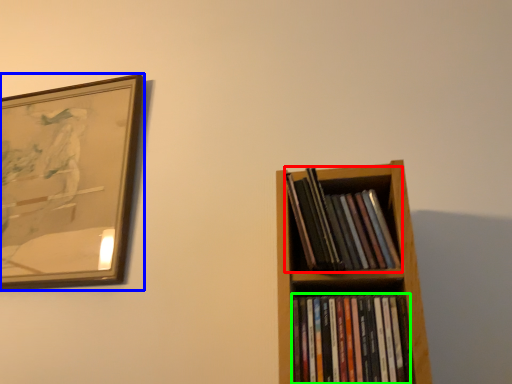
Question: Which is farther away from book (highlighted by a red box)? picture frame (highlighted by a blue box) or book (highlighted by a green box)?

Choices:
 (A) picture frame
 (B) book

Answer: (A)